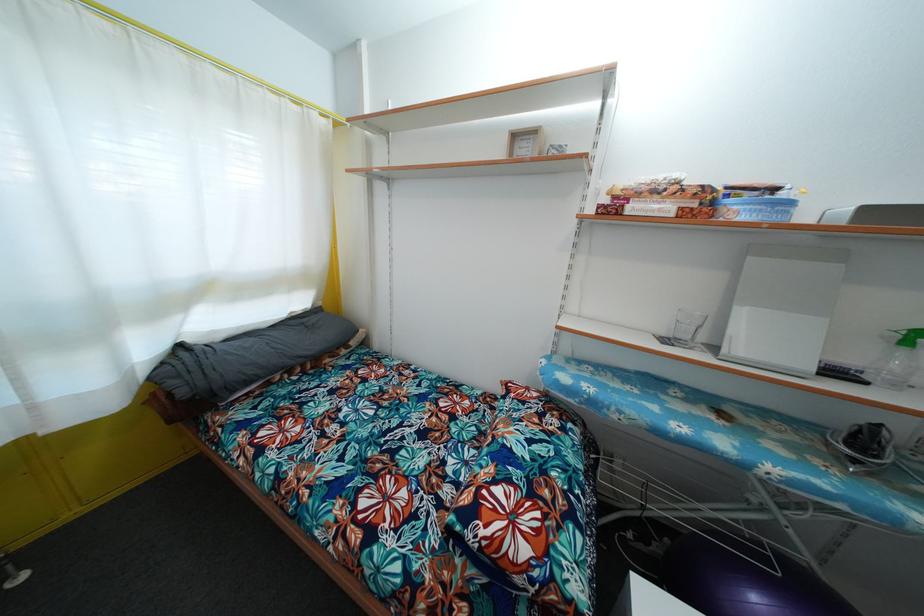
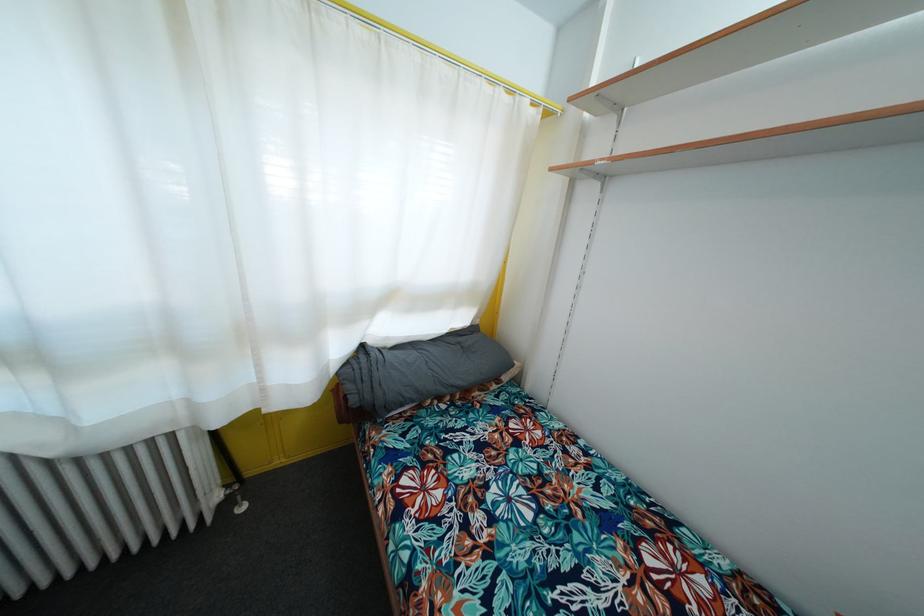
Find the pixel in the second image that matches the point at 187,399 in the first image.

(358, 407)